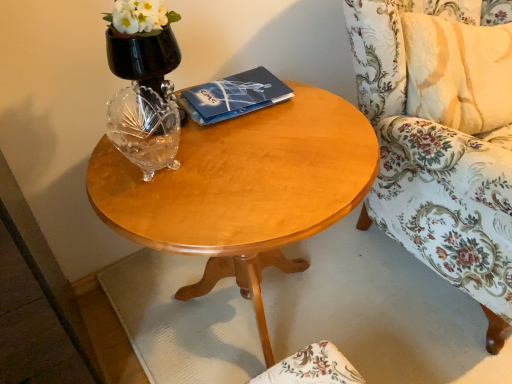
The width and height of the screenshot is (512, 384). Find the location of `unoccupied region to the right of black glass vase at upper left`. unoccupied region to the right of black glass vase at upper left is located at coordinates (249, 129).